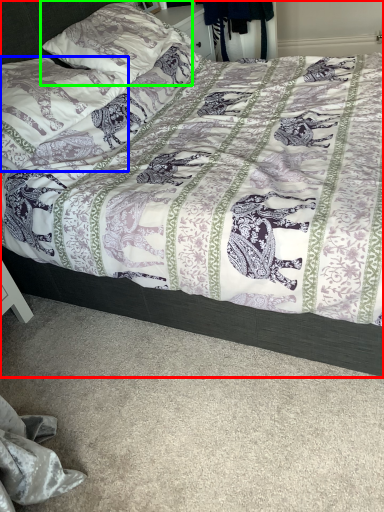
Question: Which object is positioned farthest from bed (highlighted by a red box)? Select from pillow (highlighted by a blue box) and pillow (highlighted by a green box).

Choices:
 (A) pillow
 (B) pillow

Answer: (B)